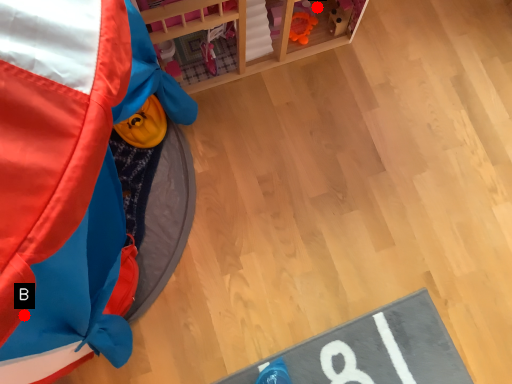
Question: Two points are circled on the image, labeled by A and B beside each circle. Among these points, which one is farthest from the camera?

Choices:
 (A) A is further
 (B) B is further

Answer: (A)